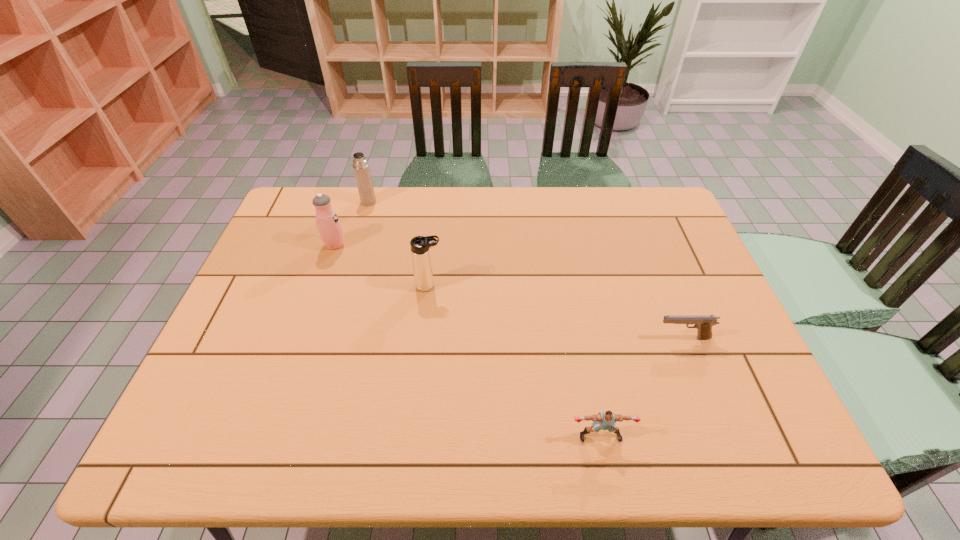
Identify the location of free space between the third object from left to right and the leftmost object. (382, 266).

Locate an element on the screen. vacant area between the rightmost object and the second thermos bottle from right to left is located at coordinates (526, 270).

In order to click on free space that is in between the nearest thermos bottle and the second thermos bottle from left to right in this screenshot , I will do `click(399, 244)`.

Find the location of `vacant point located between the rightmost object and the fourth object from right to left`. vacant point located between the rightmost object and the fourth object from right to left is located at coordinates (526, 270).

This screenshot has height=540, width=960. What are the coordinates of `free space between the second farthest object and the shortest object` in the screenshot? It's located at click(x=509, y=292).

Where is `object that is the third closest to the shortest object`? The width and height of the screenshot is (960, 540). object that is the third closest to the shortest object is located at coordinates (328, 224).

Point out which object is positioned as the second nearest to the fourth object from right to left. Please provide its 2D coordinates. Your answer should be formatted as a tuple, i.e. [(x, y)], where the tuple contains the x and y coordinates of a point satisfying the conditions above.

[(421, 259)]

This screenshot has height=540, width=960. Find the location of `the third closest thermos bottle to the pistol`. the third closest thermos bottle to the pistol is located at coordinates tap(361, 168).

Identify which thermos bottle is located as the nearest to the puncher. Please provide its 2D coordinates. Your answer should be formatted as a tuple, i.e. [(x, y)], where the tuple contains the x and y coordinates of a point satisfying the conditions above.

[(421, 259)]